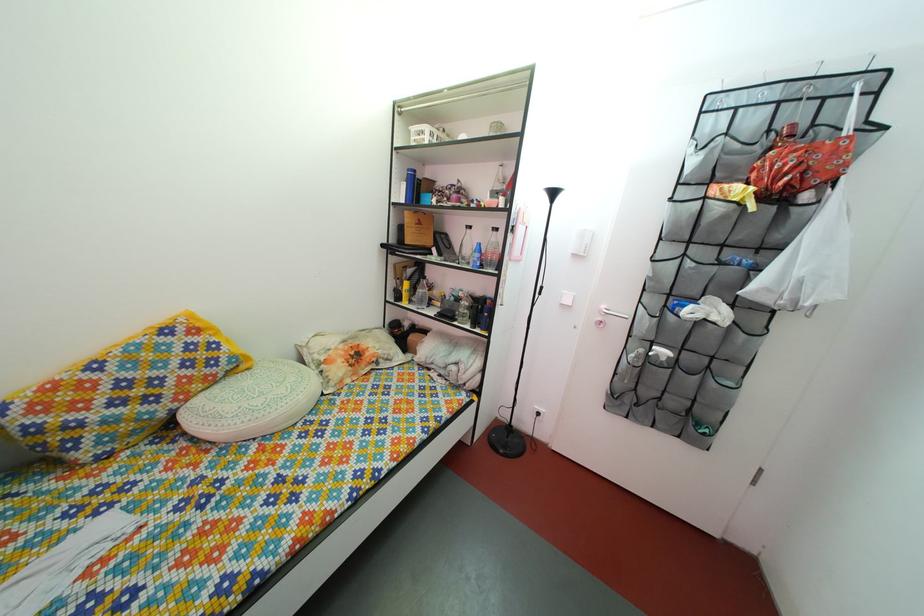
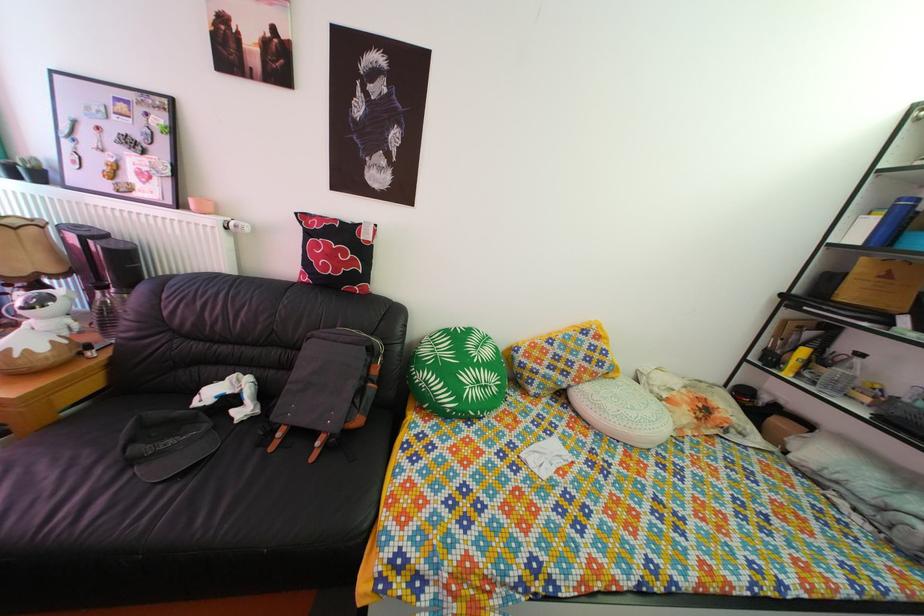
Question: I am providing you with two images of the same scene from different viewpoints. Which of the following objects are not visible in image2?

Choices:
 (A) clear water bottle
 (B) light green pillow
 (C) white thermostat knob
 (D) none of these

Answer: (D)